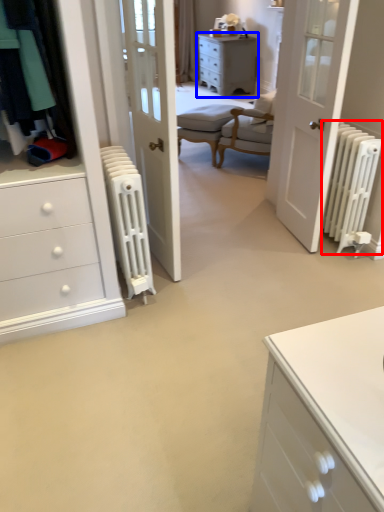
Question: Among these objects, which one is farthest to the camera, radiator (highlighted by a red box) or chest of drawers (highlighted by a blue box)?

Choices:
 (A) radiator
 (B) chest of drawers

Answer: (B)